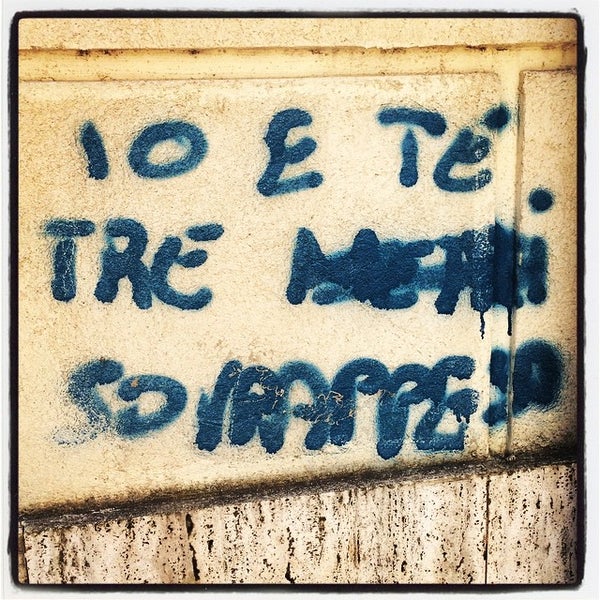
This screenshot has width=600, height=600. I want to click on wooden board, so click(367, 532).